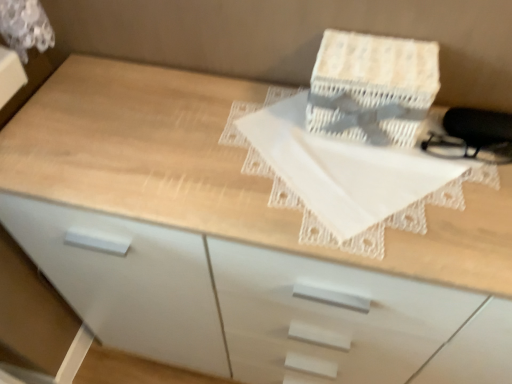
The height and width of the screenshot is (384, 512). Describe the element at coordinates (348, 173) in the screenshot. I see `white lace cloth at center` at that location.

What is the approximate height of white lace cloth at center?

It is 0.67 inches.

The width and height of the screenshot is (512, 384). In order to click on white lace cloth at center in this screenshot , I will do `click(348, 173)`.

What do you see at coordinates (372, 87) in the screenshot?
I see `white woven cardboard box at upper center` at bounding box center [372, 87].

You are a GUI agent. You are given a task and a screenshot of the screen. Output one action in this format:
    pyautogui.click(x=<x>, y=<y>)
    Task: Click on the white woven cardboard box at upper center
    The image size is (512, 384).
    Given the screenshot: What is the action you would take?
    pyautogui.click(x=372, y=87)

Where is `white lace cloth at center`? white lace cloth at center is located at coordinates (348, 173).

Between white lace cloth at center and white woven cardboard box at upper center, which one appears on the left side from the viewer's perspective?

white lace cloth at center is more to the left.

Considering the relative positions of white lace cloth at center and white woven cardboard box at upper center in the image provided, is white lace cloth at center behind white woven cardboard box at upper center?

No, white lace cloth at center is closer to the camera.

Considering the points (302, 137) and (385, 111), which point is behind, point (302, 137) or point (385, 111)?

The point (302, 137) is behind.

In the scene shown: From the image's perspective, is white lace cloth at center located above or below white woven cardboard box at upper center?

Clearly, from the image's perspective, white lace cloth at center is below white woven cardboard box at upper center.

From a real-world perspective, is white lace cloth at center beneath white woven cardboard box at upper center?

Yes, from a real-world perspective, white lace cloth at center is below white woven cardboard box at upper center.

Is white lace cloth at center thinner than white woven cardboard box at upper center?

No, white lace cloth at center is not thinner than white woven cardboard box at upper center.

Who is shorter, white lace cloth at center or white woven cardboard box at upper center?

Standing shorter between the two is white lace cloth at center.

Does white lace cloth at center have a larger size compared to white woven cardboard box at upper center?

Actually, white lace cloth at center might be smaller than white woven cardboard box at upper center.

Is white lace cloth at center completely or partially outside of white woven cardboard box at upper center?

Yes, white lace cloth at center is outside of white woven cardboard box at upper center.

In the scene shown: Are white lace cloth at center and white woven cardboard box at upper center located far from each other?

No, white lace cloth at center is in close proximity to white woven cardboard box at upper center.

Is white lace cloth at center oriented towards white woven cardboard box at upper center?

No, white lace cloth at center is not turned towards white woven cardboard box at upper center.

Can you tell me how much white lace cloth at center and white woven cardboard box at upper center differ in facing direction?

0.000101 degrees.

Locate an element on the screen. The image size is (512, 384). cardboard box above the white lace cloth at center (from the image's perspective) is located at coordinates (372, 87).

Which object is positioned more to the left, white woven cardboard box at upper center or white lace cloth at center?

white lace cloth at center is more to the left.

Consider the image. Is white woven cardboard box at upper center positioned in front of white lace cloth at center?

No, it is not.

Is point (383, 140) positioned behind point (313, 181)?

Yes, it is.

From the image's perspective, between white woven cardboard box at upper center and white lace cloth at center, who is located below?

white lace cloth at center.

From a real-world perspective, is white woven cardboard box at upper center below white lace cloth at center?

No, from a real-world perspective, white woven cardboard box at upper center is not below white lace cloth at center.

From the picture: Does white woven cardboard box at upper center have a lesser width compared to white lace cloth at center?

Correct, the width of white woven cardboard box at upper center is less than that of white lace cloth at center.

Considering the relative sizes of white woven cardboard box at upper center and white lace cloth at center in the image provided, is white woven cardboard box at upper center shorter than white lace cloth at center?

Incorrect, the height of white woven cardboard box at upper center does not fall short of that of white lace cloth at center.

Which of these two, white woven cardboard box at upper center or white lace cloth at center, is smaller?

white lace cloth at center is smaller.

Can white lace cloth at center be found inside white woven cardboard box at upper center?

Definitely not — white lace cloth at center is not inside white woven cardboard box at upper center.

Is white woven cardboard box at upper center positioned far away from white lace cloth at center?

white woven cardboard box at upper center is near white lace cloth at center, not far away.

Is white woven cardboard box at upper center looking in the opposite direction of white lace cloth at center?

No, white woven cardboard box at upper center is not facing the opposite direction of white lace cloth at center.

Where is `cardboard box lying above the white lace cloth at center (from the image's perspective)`? This screenshot has height=384, width=512. cardboard box lying above the white lace cloth at center (from the image's perspective) is located at coordinates (372, 87).

Where is `cardboard box that appears behind the white lace cloth at center`? The height and width of the screenshot is (384, 512). cardboard box that appears behind the white lace cloth at center is located at coordinates (372, 87).

Image resolution: width=512 pixels, height=384 pixels. I want to click on sheet below the white woven cardboard box at upper center (from the image's perspective), so click(348, 173).